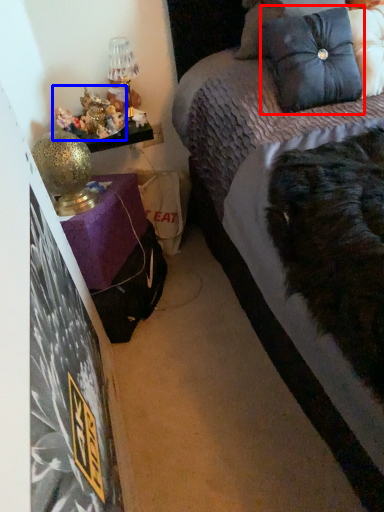
Question: Which point is closer to the camera, pillow (highlighted by a red box) or stuff (highlighted by a blue box)?

Choices:
 (A) pillow
 (B) stuff

Answer: (A)